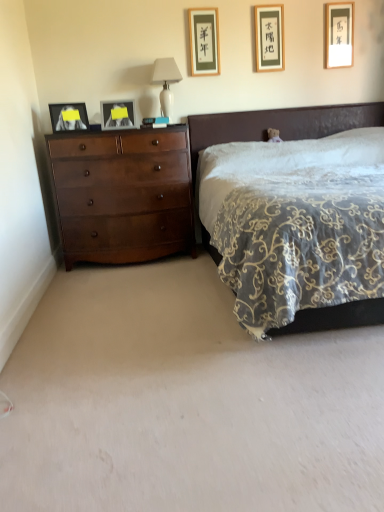
Question: Is velvet dark brown bed at center shorter than white glossy table lamp at upper center?

Choices:
 (A) no
 (B) yes

Answer: (A)

Question: Is velvet dark brown bed at center to the left of white glossy table lamp at upper center from the viewer's perspective?

Choices:
 (A) no
 (B) yes

Answer: (A)

Question: Can you confirm if velvet dark brown bed at center is bigger than white glossy table lamp at upper center?

Choices:
 (A) yes
 (B) no

Answer: (A)

Question: From a real-world perspective, is velvet dark brown bed at center physically above white glossy table lamp at upper center?

Choices:
 (A) no
 (B) yes

Answer: (A)

Question: Can you confirm if velvet dark brown bed at center is positioned to the right of white glossy table lamp at upper center?

Choices:
 (A) yes
 (B) no

Answer: (A)

Question: Is velvet dark brown bed at center positioned beyond the bounds of white glossy table lamp at upper center?

Choices:
 (A) yes
 (B) no

Answer: (A)

Question: Does black paper picture frame at upper center, the third picture frame from the left, come behind white glossy table lamp at upper center?

Choices:
 (A) no
 (B) yes

Answer: (B)

Question: Is black paper picture frame at upper center, the 3th picture frame viewed from the right, wider than white glossy table lamp at upper center?

Choices:
 (A) no
 (B) yes

Answer: (A)

Question: Considering the relative sizes of black paper picture frame at upper center, the third picture frame from the left, and white glossy table lamp at upper center in the image provided, is black paper picture frame at upper center, the third picture frame from the left, taller than white glossy table lamp at upper center?

Choices:
 (A) yes
 (B) no

Answer: (B)

Question: Is black paper picture frame at upper center, the third picture frame from the left, touching white glossy table lamp at upper center?

Choices:
 (A) no
 (B) yes

Answer: (A)

Question: Could you tell me if black paper picture frame at upper center, the third picture frame from the left, is turned towards white glossy table lamp at upper center?

Choices:
 (A) yes
 (B) no

Answer: (B)

Question: From the image's perspective, is black paper picture frame at upper center, the third picture frame from the left, below white glossy table lamp at upper center?

Choices:
 (A) yes
 (B) no

Answer: (B)

Question: Is matte black picture frame at upper center, which is the second picture frame from left to right, further to the viewer compared to matte gold picture frame at upper right, which ranks as the first picture frame in right-to-left order?

Choices:
 (A) yes
 (B) no

Answer: (B)